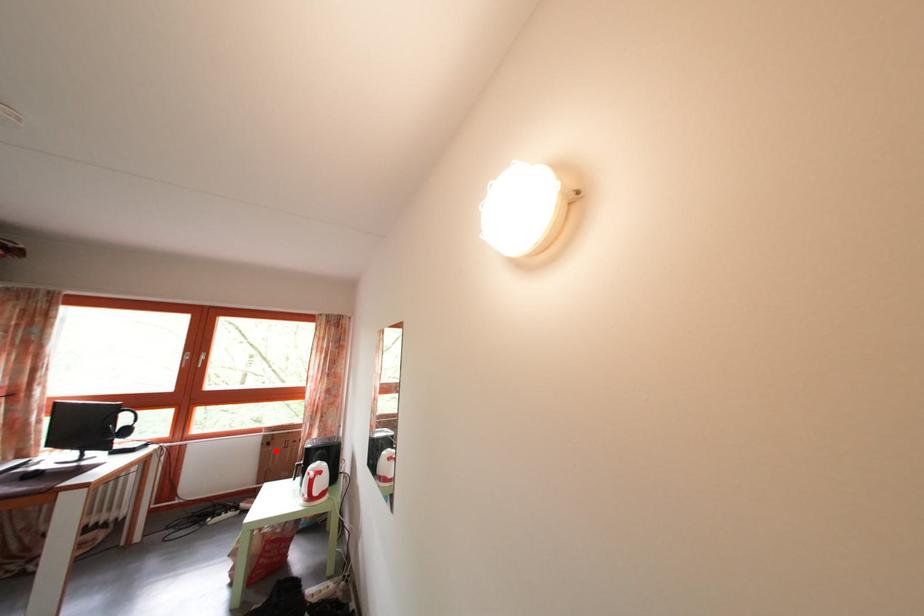
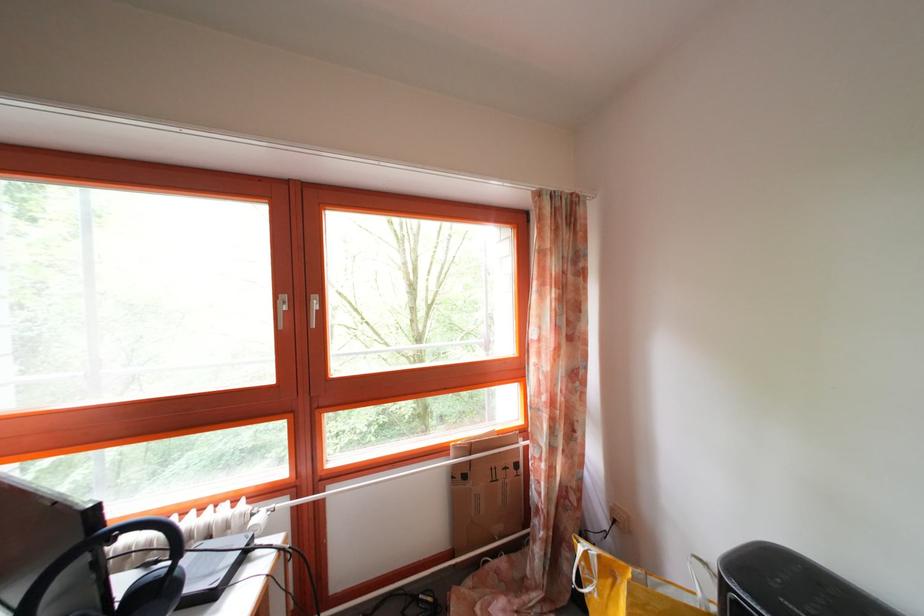
Where in the second image is the point corresponding to the highlighted location from the first image?

(472, 484)